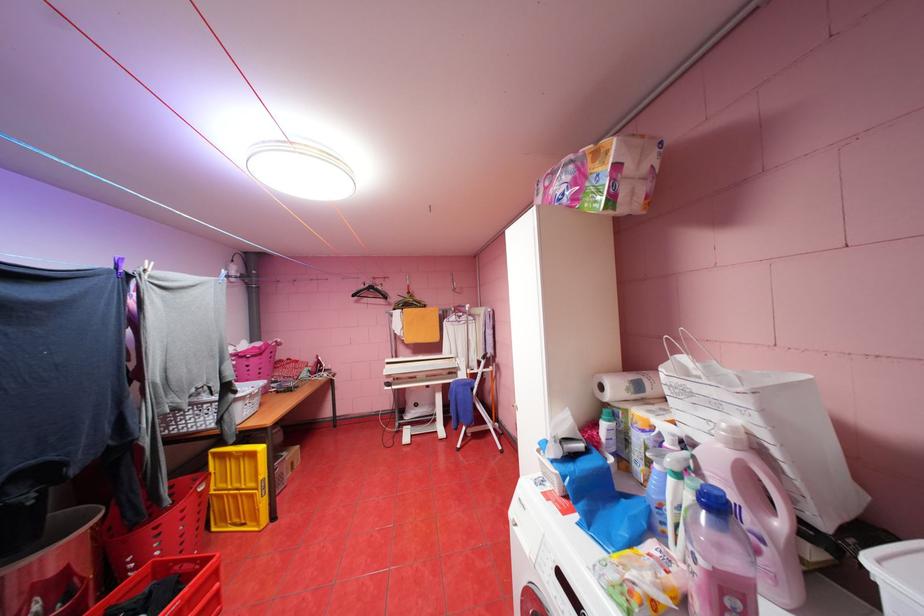
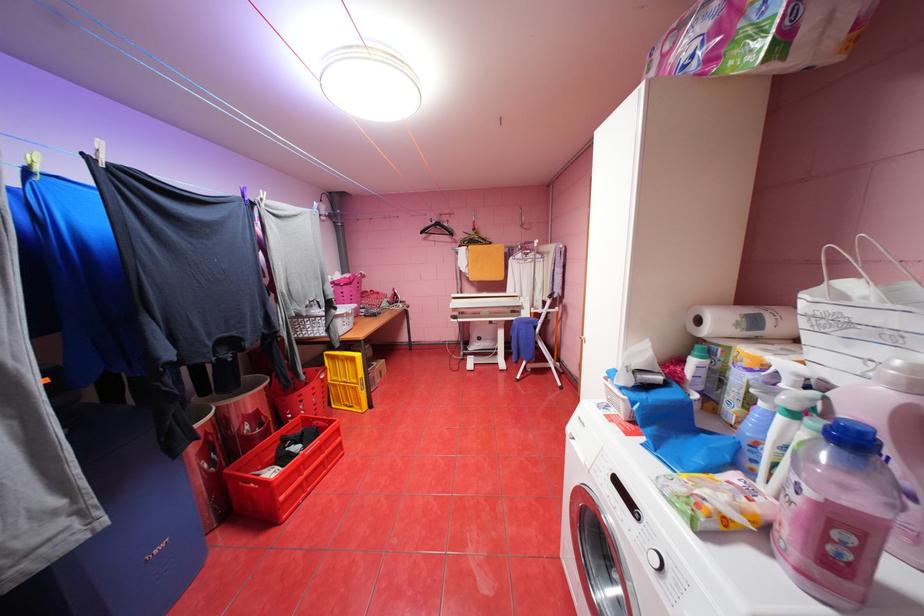
In a continuous first-person perspective shot, in which direction is the camera moving?

The movement direction of the cameraman is left, forward.